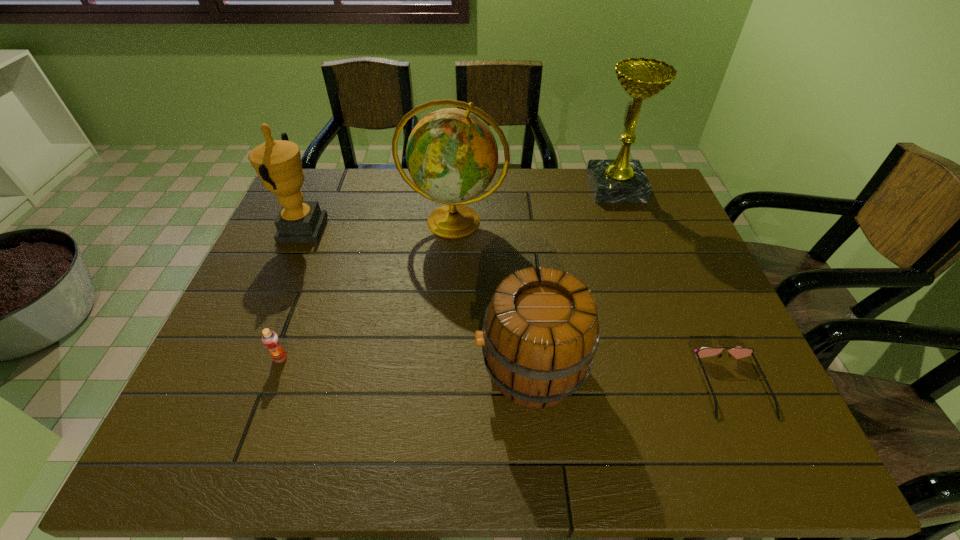
Find the location of a particular element. This screenshot has height=540, width=960. orange juice that is at the left edge is located at coordinates (270, 339).

You are a GUI agent. You are given a task and a screenshot of the screen. Output one action in this format:
    pyautogui.click(x=<x>, y=<y>)
    Task: Click on the award at the right edge
    The image size is (960, 540).
    Given the screenshot: What is the action you would take?
    pyautogui.click(x=622, y=180)

The image size is (960, 540). I want to click on sunglasses that is at the right edge, so click(738, 352).

The width and height of the screenshot is (960, 540). I want to click on object that is at the far left corner, so click(278, 163).

Where is `object present at the far right corner`? object present at the far right corner is located at coordinates (622, 180).

Where is `object that is at the near right corner`? Image resolution: width=960 pixels, height=540 pixels. object that is at the near right corner is located at coordinates (738, 352).

You are a GUI agent. You are given a task and a screenshot of the screen. Output one action in this format:
    pyautogui.click(x=<x>, y=<y>)
    Task: Click on the free space at the far edge
    This screenshot has height=540, width=960.
    Given the screenshot: What is the action you would take?
    pyautogui.click(x=511, y=202)

Where is `free space at the near edge of the desktop`? The image size is (960, 540). free space at the near edge of the desktop is located at coordinates (321, 455).

Where is `vacant space at the left edge of the desktop`? The image size is (960, 540). vacant space at the left edge of the desktop is located at coordinates (224, 392).

Image resolution: width=960 pixels, height=540 pixels. In the image, there is a desktop. What are the coordinates of `blank space at the right edge` in the screenshot? It's located at (661, 295).